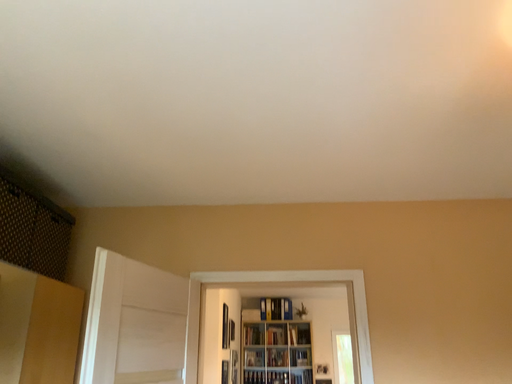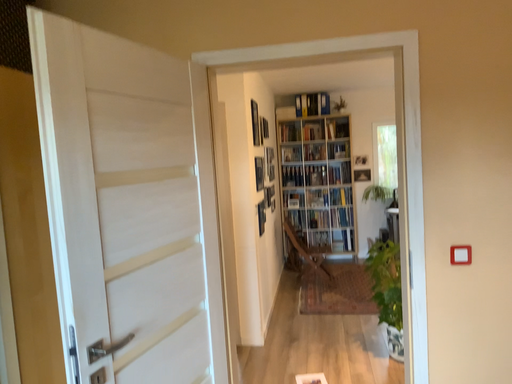
Question: Which way did the camera rotate in the video?

Choices:
 (A) rotated upward
 (B) rotated downward

Answer: (B)